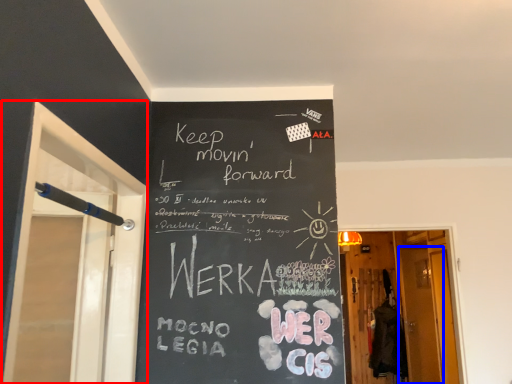
Question: Which point is further to the camera, screen door (highlighted by a red box) or screen door (highlighted by a blue box)?

Choices:
 (A) screen door
 (B) screen door

Answer: (B)